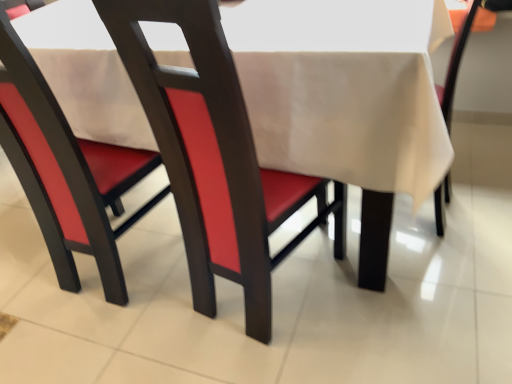
Identify the location of vacant space that is to the left of matte red chair at center, acting as the 1th chair starting from the left. (25, 273).